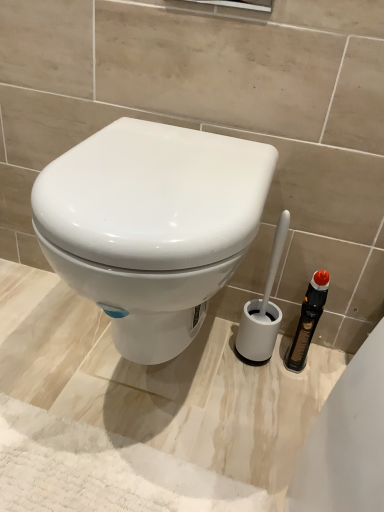
Question: Considering the positions of white plastic toilet brush at right and white glossy toilet at center in the image, is white plastic toilet brush at right taller or shorter than white glossy toilet at center?

Choices:
 (A) short
 (B) tall

Answer: (A)

Question: From a real-world perspective, is white plastic toilet brush at right positioned above or below white glossy toilet at center?

Choices:
 (A) above
 (B) below

Answer: (B)

Question: Looking at the image, does white plastic toilet brush at right seem bigger or smaller compared to white glossy toilet at center?

Choices:
 (A) big
 (B) small

Answer: (B)

Question: Is point (145, 172) positioned closer to the camera than point (278, 309)?

Choices:
 (A) closer
 (B) farther

Answer: (A)

Question: From a real-world perspective, relative to white plastic toilet brush at right, is white glossy toilet at center vertically above or below?

Choices:
 (A) above
 (B) below

Answer: (A)

Question: Based on their sizes in the image, would you say white glossy toilet at center is bigger or smaller than white plastic toilet brush at right?

Choices:
 (A) small
 (B) big

Answer: (B)

Question: Would you say white glossy toilet at center is inside or outside white plastic toilet brush at right?

Choices:
 (A) outside
 (B) inside

Answer: (A)